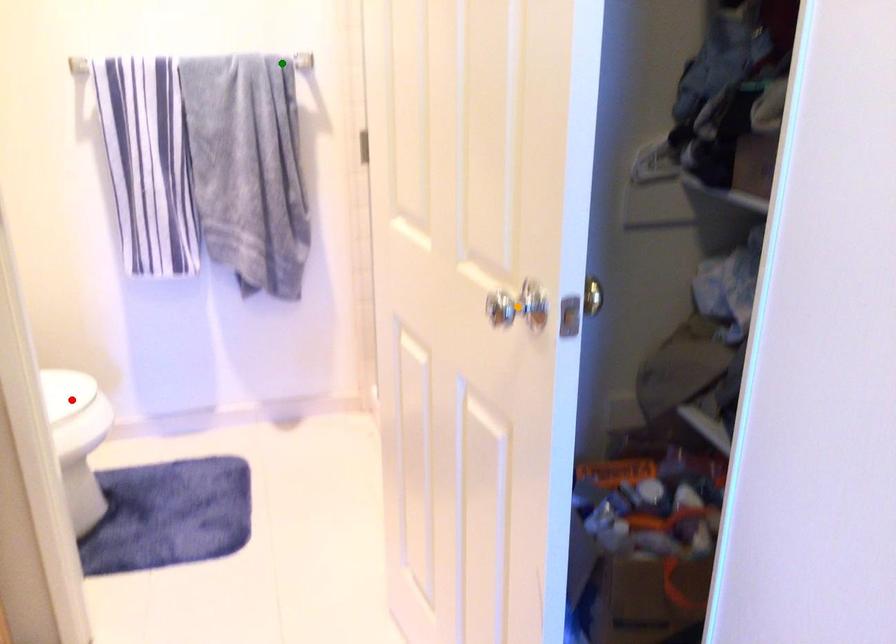
Order these from nearest to farthest:
- orange point
- green point
- red point

green point
red point
orange point